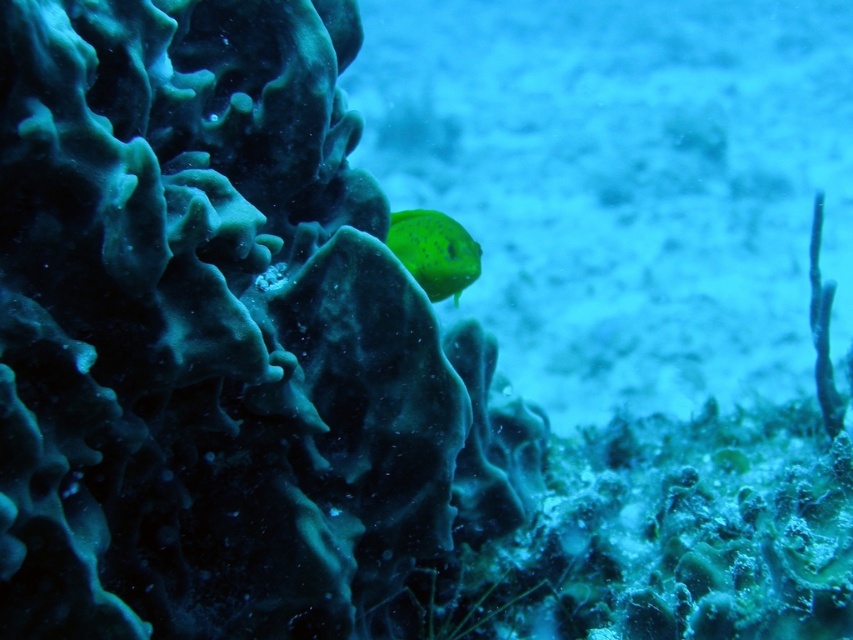
Question: Considering the relative positions of translucent green water at center and green matte fish at upper center in the image provided, where is translucent green water at center located with respect to green matte fish at upper center?

Choices:
 (A) left
 (B) right

Answer: (B)

Question: Which object is farther from the camera taking this photo?

Choices:
 (A) translucent green water at center
 (B) green matte fish at upper center

Answer: (A)

Question: Is translucent green water at center below green matte fish at upper center?

Choices:
 (A) yes
 (B) no

Answer: (B)

Question: Does translucent green water at center appear on the right side of green matte fish at upper center?

Choices:
 (A) yes
 (B) no

Answer: (A)